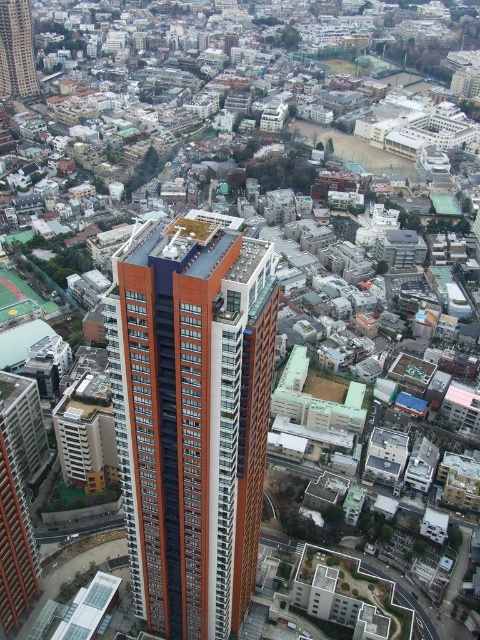
You are a city planner reviewing an aerial view of an urban area. You notice two prominent orange structures at the center. Which one is wider, the orange glassy building at center or the orange glass tower at center?

The orange glassy building at center is wider than the orange glass tower at center according to the description.

You are a city planner reviewing the aerial image of the urban area. You notice two prominent orange structures labeled as the orange glassy building at center and the orange glass tower at center. Which of these two buildings has a larger footprint in the image?

The orange glassy building at center has a larger footprint than the orange glass tower at center according to the description.